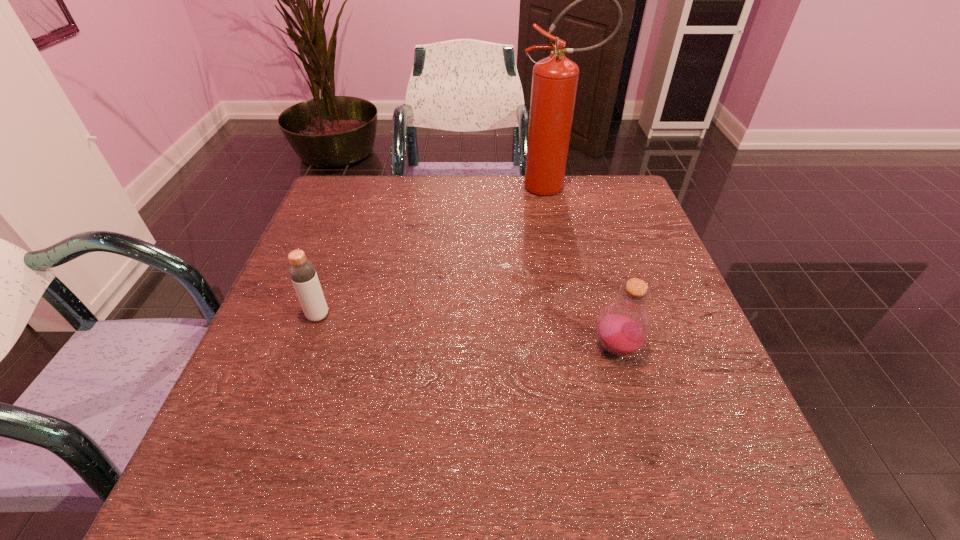
Find the location of a particular element. The width and height of the screenshot is (960, 540). free space at the far left corner is located at coordinates (321, 211).

This screenshot has height=540, width=960. In order to click on vacant space at the near left corner in this screenshot , I will do `click(276, 506)`.

This screenshot has width=960, height=540. What are the coordinates of `blank area at the far right corner` in the screenshot? It's located at (618, 200).

I want to click on vacant area at the near right corner of the desktop, so click(x=755, y=490).

This screenshot has height=540, width=960. In order to click on vacant space that is in between the right bottle and the tallest object in this screenshot , I will do `click(586, 267)`.

At what (x,y) coordinates should I click in order to perform the action: click on empty space that is in between the nearer bottle and the leftmost object. Please return your answer as a coordinate pair (x, y). Looking at the image, I should click on (468, 332).

This screenshot has height=540, width=960. Identify the location of vacant area that lies between the right bottle and the tallest object. (586, 267).

Locate an element on the screen. Image resolution: width=960 pixels, height=540 pixels. vacant area that lies between the fire extinguisher and the nearest object is located at coordinates (586, 267).

Where is `empty location between the fire extinguisher and the nearest object`? This screenshot has height=540, width=960. empty location between the fire extinguisher and the nearest object is located at coordinates (586, 267).

Image resolution: width=960 pixels, height=540 pixels. In order to click on free spot between the tallest object and the farther bottle in this screenshot , I will do `click(436, 251)`.